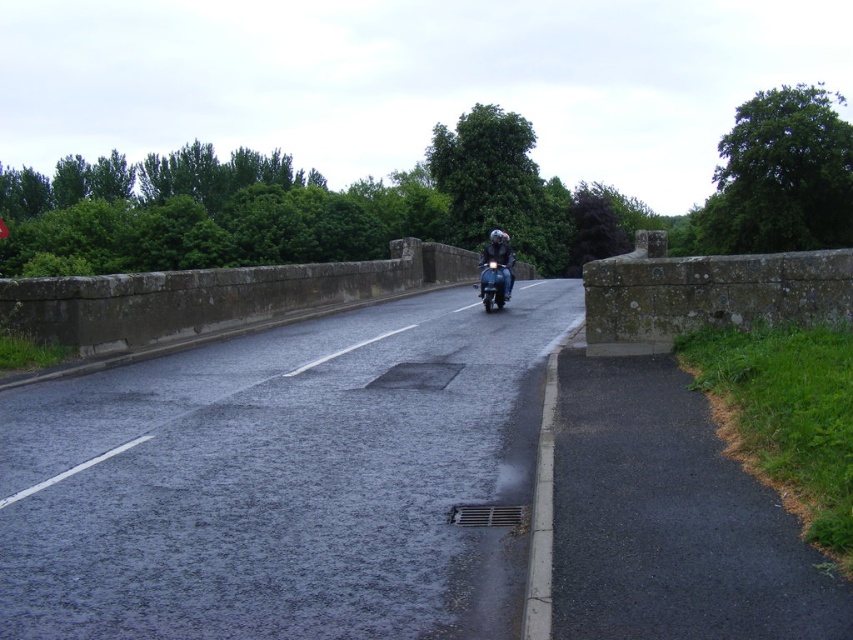
You are a pedestrian standing on the side of the road and see the glossy asphalt road at center and the shiny black helmet at center. Which object appears larger in the image?

The shiny black helmet at center appears larger because the glossy asphalt road at center has a smaller size compared to it.

You are a delivery driver who needs to measure the distance between the shiny black helmet at center and the glossy black motorcycle at center in the image. Can you confirm if the distance is less than 24 inches?

The distance between the shiny black helmet at center and the glossy black motorcycle at center is 23.31 inches, which is less than 24 inches.

You are a pedestrian standing on the sidewalk near the wet road. You see the glossy asphalt road at center and the shiny black helmet at center. If you want to cross the road safely, which object should you wait until it is clear of before proceeding?

You should wait until the shiny black helmet at center has passed because it is closer to you than the glossy asphalt road at center, and the distance between them is 9.62 meters. Ensure the shiny black helmet at center is clear before crossing.